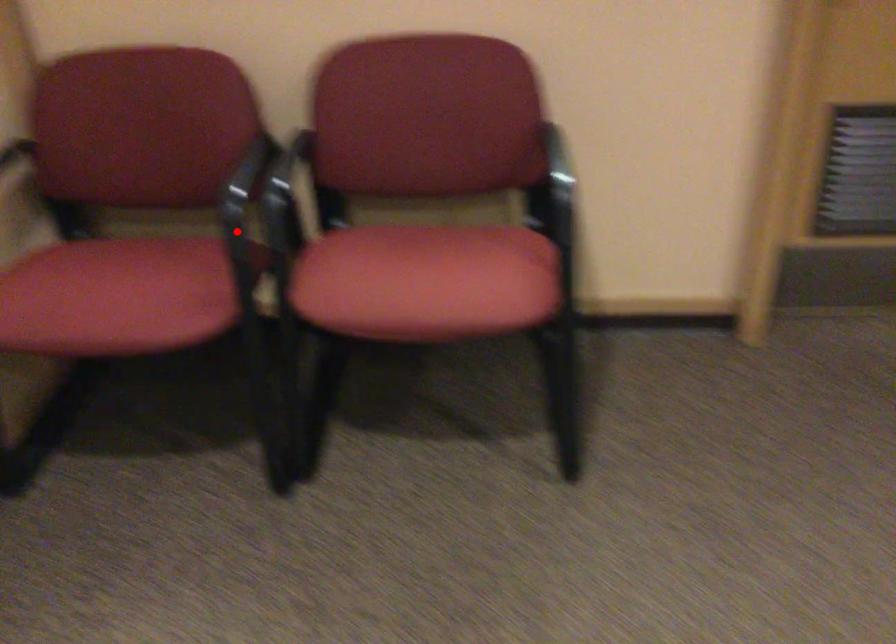
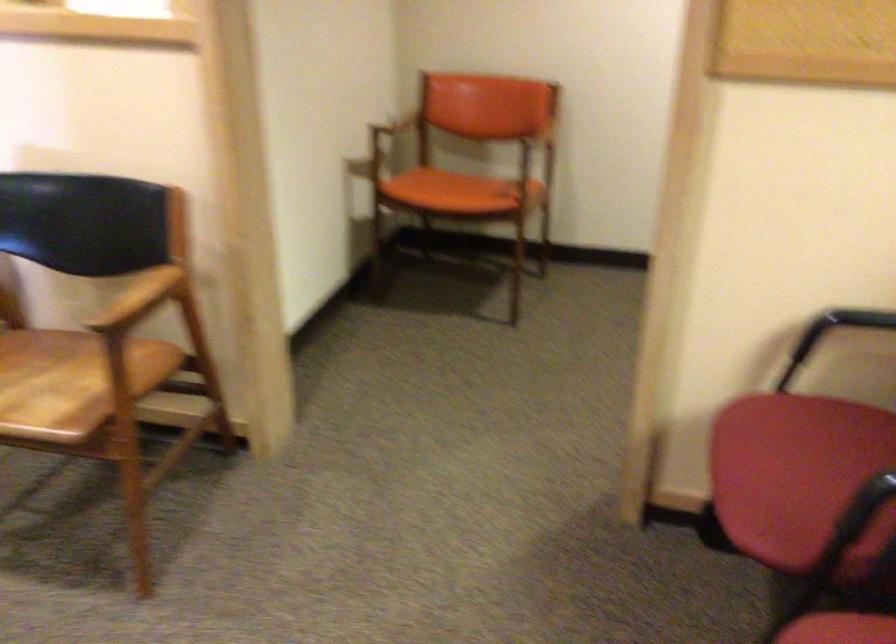
Question: I am providing you with two images of the same scene from different viewpoints. A red point is marked on the first image. Is the red point's position out of view in image 2?

Choices:
 (A) Yes
 (B) No

Answer: (B)